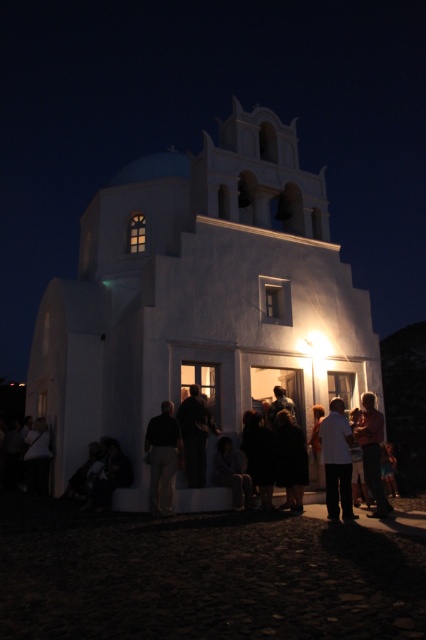
You are standing outside the white, traditional building at night and want to take a photo of the white matte church at center and the dark gray pants at center. Which object should you focus on first if you want to capture both in the same frame without moving the camera?

The white matte church at center is to the left of dark gray pants at center, so you should focus on the white matte church at center first to ensure both are in the same frame without moving the camera.

You are standing outside the church entrance and see a point marked at coordinates (x=336, y=460). Based on the scene description, what object or feature is located at that point?

The point at coordinates (x=336, y=460) indicates the white matte shirt at center.